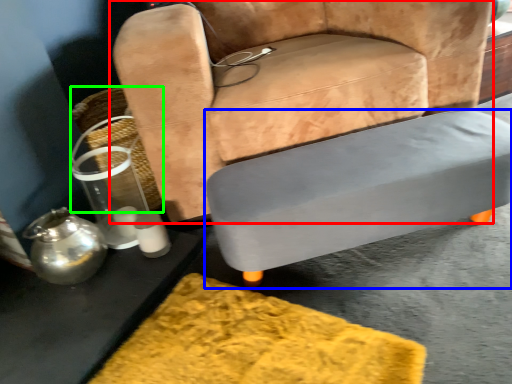
Question: Which object is positioned closest to chair (highlighted by a red box)? Select from table (highlighted by a blue box) and basket (highlighted by a green box).

Choices:
 (A) table
 (B) basket

Answer: (A)